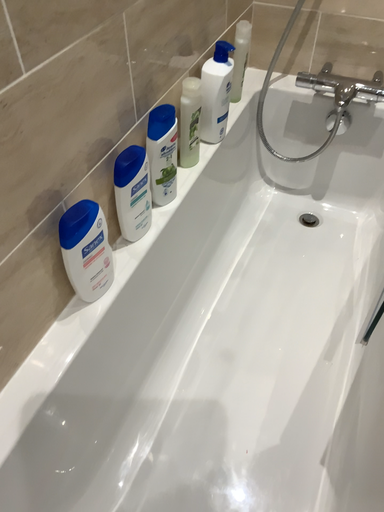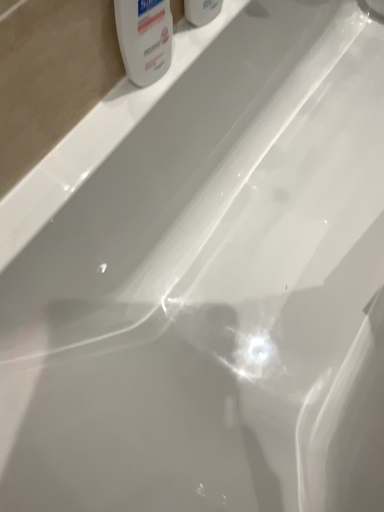
Question: Which way did the camera rotate in the video?

Choices:
 (A) rotated right
 (B) rotated left

Answer: (B)